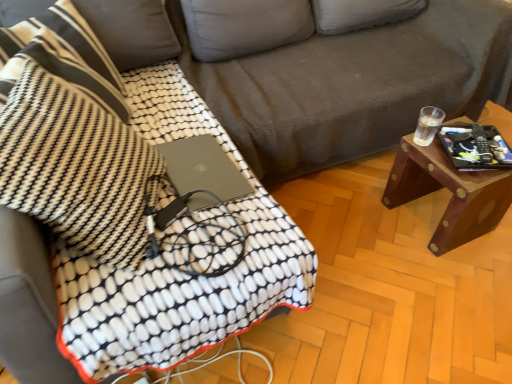
What do you see at coordinates (326, 76) in the screenshot? The height and width of the screenshot is (384, 512). I see `gray corduroy couch at center` at bounding box center [326, 76].

What do you see at coordinates (201, 134) in the screenshot? I see `white textured blanket at center` at bounding box center [201, 134].

Identify the location of black matte tablet at right. This screenshot has height=384, width=512. (475, 147).

In order to face black matte tablet at right, should I rotate leftwards or rightwards?

Rotate your view right by about 27.403°.

Where is `black textured throw pillow at left, positioned as the 1th throw pillow in front-to-back order`? black textured throw pillow at left, positioned as the 1th throw pillow in front-to-back order is located at coordinates (75, 168).

You are a GUI agent. You are given a task and a screenshot of the screen. Output one action in this format:
    pyautogui.click(x=<x>, y=<y>)
    Task: Click on the matte black laptop at center
    Image resolution: width=512 pixels, height=384 pixels.
    Given the screenshot: What is the action you would take?
    pyautogui.click(x=203, y=171)

The width and height of the screenshot is (512, 384). I want to click on gray corduroy couch at center, so click(x=326, y=76).

From a real-world perspective, between gray corduroy couch at center and white textured blanket at center, who is vertically lower?

white textured blanket at center is physically lower.

Identify the location of blanket on the left side of gray corduroy couch at center. (201, 134).

Is gray corduroy couch at center taller than white textured blanket at center?

Yes, gray corduroy couch at center is taller than white textured blanket at center.

From the image's perspective, which one is positioned higher, gray corduroy couch at center or white textured blanket at center?

From the image's view, gray corduroy couch at center is above.

Who is more distant, black textured throw pillow at upper left, which is the first throw pillow from back to front, or matte black laptop at center?

Positioned behind is matte black laptop at center.

Who is taller, black textured throw pillow at upper left, which is the first throw pillow from back to front, or matte black laptop at center?

black textured throw pillow at upper left, which is the first throw pillow from back to front, is taller.

Is black textured throw pillow at upper left, which is the first throw pillow from back to front, beside matte black laptop at center?

No.

In terms of width, does black textured throw pillow at upper left, which ranks as the 2th throw pillow in front-to-back order, look wider or thinner when compared to matte black laptop at center?

Clearly, black textured throw pillow at upper left, which ranks as the 2th throw pillow in front-to-back order, has more width compared to matte black laptop at center.

What's the angular difference between white textured blanket at center and gray corduroy couch at center's facing directions?

The facing directions of white textured blanket at center and gray corduroy couch at center are 91.6 degrees apart.

From a real-world perspective, who is located higher, white textured blanket at center or gray corduroy couch at center?

gray corduroy couch at center.

Are white textured blanket at center and gray corduroy couch at center making contact?

white textured blanket at center is not next to gray corduroy couch at center, and they're not touching.

Is gray corduroy couch at center inside the boundaries of woodenmaterial/texturetable at right, or outside?

gray corduroy couch at center lies outside woodenmaterial/texturetable at right.

Considering the relative sizes of gray corduroy couch at center and woodenmaterial/texturetable at right in the image provided, is gray corduroy couch at center taller than woodenmaterial/texturetable at right?

Indeed, gray corduroy couch at center has a greater height compared to woodenmaterial/texturetable at right.

Is the depth of gray corduroy couch at center less than that of woodenmaterial/texturetable at right?

Yes, gray corduroy couch at center is closer to the viewer.

Who is smaller, gray corduroy couch at center or woodenmaterial/texturetable at right?

Smaller between the two is woodenmaterial/texturetable at right.

From the picture: Looking at their sizes, would you say matte black laptop at center is wider or thinner than gray corduroy couch at center?

Clearly, matte black laptop at center has less width compared to gray corduroy couch at center.

Are matte black laptop at center and gray corduroy couch at center far apart?

No, matte black laptop at center is not far away from gray corduroy couch at center.

Measure the distance between matte black laptop at center and gray corduroy couch at center.

matte black laptop at center is 24.74 inches away from gray corduroy couch at center.

Is matte black laptop at center not within gray corduroy couch at center?

Absolutely, matte black laptop at center is external to gray corduroy couch at center.

Considering their positions, is black matte tablet at right located in front of or behind matte black laptop at center?

black matte tablet at right is positioned farther from the viewer than matte black laptop at center.

Is black matte tablet at right positioned with its back to matte black laptop at center?

Absolutely, black matte tablet at right is directed away from matte black laptop at center.

Which object is positioned more to the left, black matte tablet at right or matte black laptop at center?

matte black laptop at center is more to the left.

Can we say black matte tablet at right lies outside matte black laptop at center?

Yes.

Is matte black laptop at center next to black textured throw pillow at upper left, which ranks as the 2th throw pillow in front-to-back order, and touching it?

No, matte black laptop at center is not beside black textured throw pillow at upper left, which ranks as the 2th throw pillow in front-to-back order.

Consider the image. Considering the relative positions of matte black laptop at center and black textured throw pillow at upper left, which ranks as the 2th throw pillow in front-to-back order, in the image provided, is matte black laptop at center to the left or to the right of black textured throw pillow at upper left, which ranks as the 2th throw pillow in front-to-back order,?

matte black laptop at center is to the right of black textured throw pillow at upper left, which ranks as the 2th throw pillow in front-to-back order.

How different are the orientations of matte black laptop at center and black textured throw pillow at upper left, which is the first throw pillow from back to front, in degrees?

They differ by 123 degrees in their facing directions.

Identify the location of blanket below the gray corduroy couch at center (from the image's perspective). (201, 134).

At what (x,y) coordinates should I click in order to perform the action: click on laptop beneath the black textured throw pillow at upper left, which ranks as the 2th throw pillow in front-to-back order (from a real-world perspective). Please return your answer as a coordinate pair (x, y). Looking at the image, I should click on (203, 171).

Looking at the image, which one is located closer to white textured blanket at center, woodenmaterial/texturetable at right or matte black laptop at center?

matte black laptop at center is closer to white textured blanket at center.

Estimate the real-world distances between objects in this image. Which object is closer to gray corduroy couch at center, woodenmaterial/texturetable at right or matte black laptop at center?

woodenmaterial/texturetable at right.

From the image, which object appears to be farther from matte black laptop at center, black textured throw pillow at upper left, which is the first throw pillow from back to front, or white textured blanket at center?

Based on the image, black textured throw pillow at upper left, which is the first throw pillow from back to front, appears to be further to matte black laptop at center.

Estimate the real-world distances between objects in this image. Which object is further from black textured throw pillow at upper left, which is the first throw pillow from back to front, black textured throw pillow at left, positioned as the 1th throw pillow in front-to-back order, or black matte tablet at right?

black matte tablet at right is further to black textured throw pillow at upper left, which is the first throw pillow from back to front.

Considering their positions, is gray corduroy couch at center positioned closer to black textured throw pillow at upper left, which ranks as the 2th throw pillow in front-to-back order, than matte black laptop at center?

matte black laptop at center.

Considering their positions, is woodenmaterial/texturetable at right positioned further to gray corduroy couch at center than black matte tablet at right?

Among the two, black matte tablet at right is located further to gray corduroy couch at center.

Looking at the image, which one is located closer to black textured throw pillow at left, positioned as the 1th throw pillow in front-to-back order, black matte tablet at right or black textured throw pillow at upper left, which is the first throw pillow from back to front?

black textured throw pillow at upper left, which is the first throw pillow from back to front, lies closer to black textured throw pillow at left, positioned as the 1th throw pillow in front-to-back order, than the other object.

Based on their spatial positions, is woodenmaterial/texturetable at right or gray corduroy couch at center closer to black textured throw pillow at upper left, which is the first throw pillow from back to front?

The object closer to black textured throw pillow at upper left, which is the first throw pillow from back to front, is gray corduroy couch at center.

Locate an element on the screen. studio couch located between matte black laptop at center and black matte tablet at right in the left-right direction is located at coordinates (326, 76).

Locate an element on the screen. This screenshot has width=512, height=384. blanket located between black textured throw pillow at left, positioned as the 1th throw pillow in front-to-back order, and matte black laptop at center in the depth direction is located at coordinates (201, 134).

This screenshot has height=384, width=512. Find the location of `laptop located between white textured blanket at center and woodenmaterial/texturetable at right in the left-right direction`. laptop located between white textured blanket at center and woodenmaterial/texturetable at right in the left-right direction is located at coordinates coord(203,171).

I want to click on throw pillow between black textured throw pillow at upper left, which ranks as the 2th throw pillow in front-to-back order, and gray corduroy couch at center, in the horizontal direction, so click(x=75, y=168).